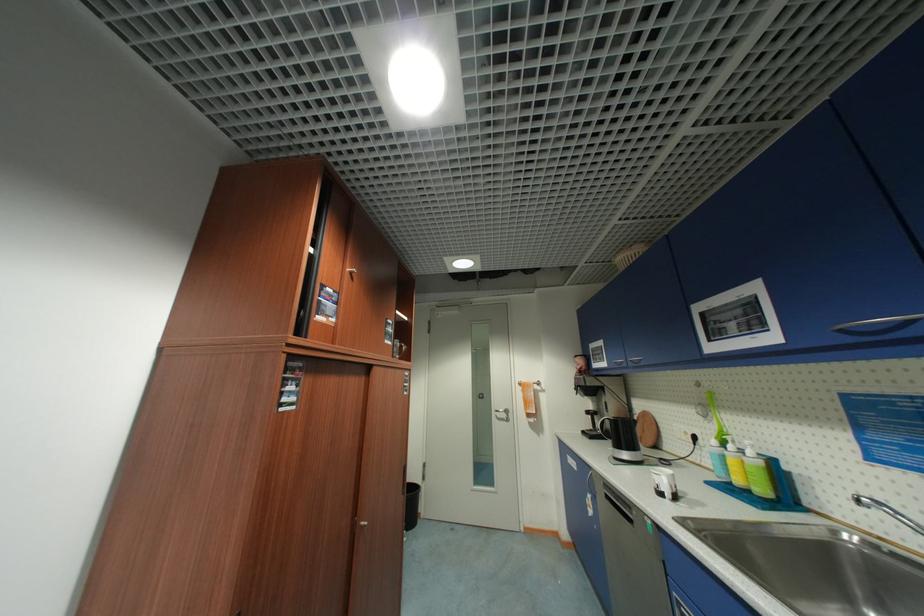
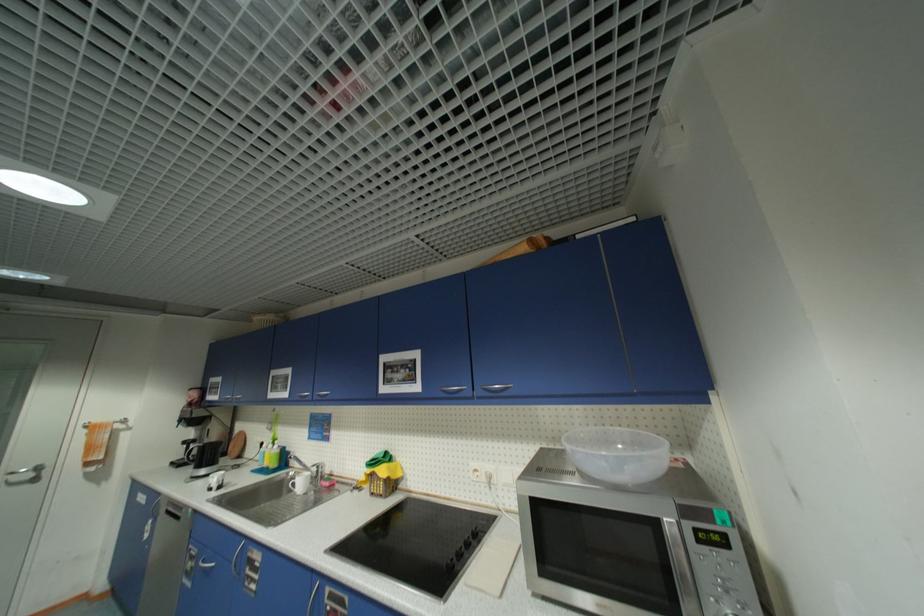
Locate, in the second image, the point that corresponds to the point at 593,413 in the first image.

(190, 444)